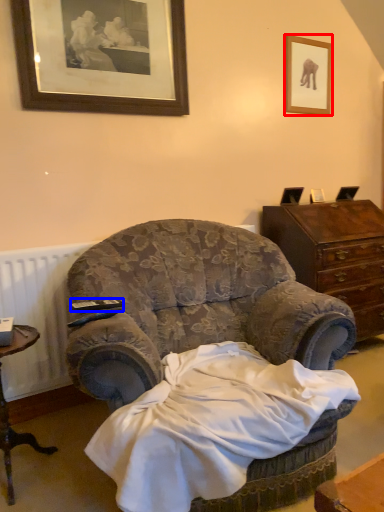
Question: Which point is closer to the camera, picture frame (highlighted by a red box) or remote control (highlighted by a blue box)?

Choices:
 (A) picture frame
 (B) remote control

Answer: (B)